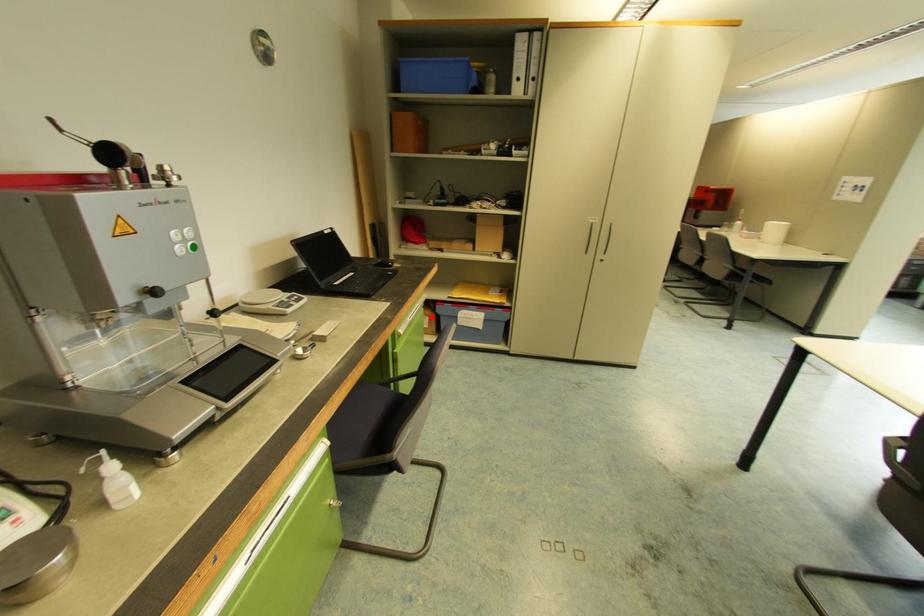
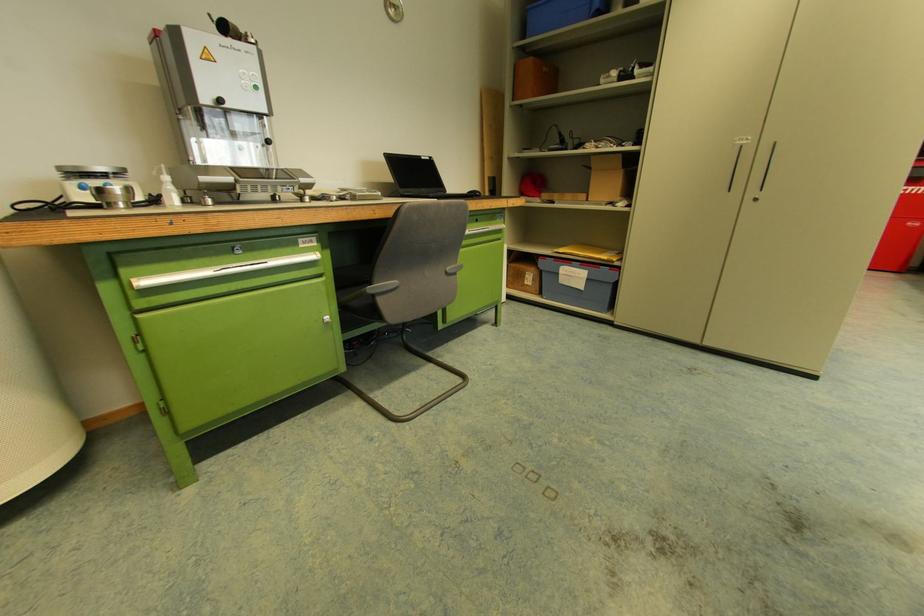
Locate, in the second image, the point that corresponds to the highlighted location in the first image.

(536, 275)